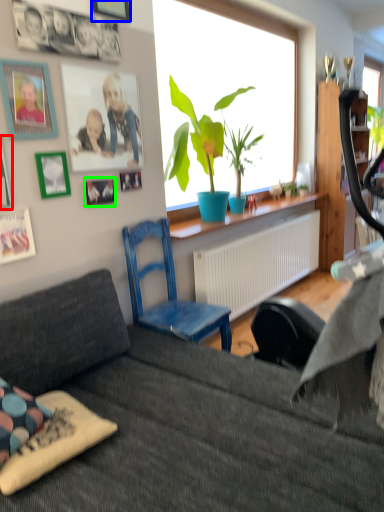
Question: Which is farther away from picture frame (highlighted by a red box)? picture frame (highlighted by a blue box) or picture frame (highlighted by a green box)?

Choices:
 (A) picture frame
 (B) picture frame

Answer: (A)